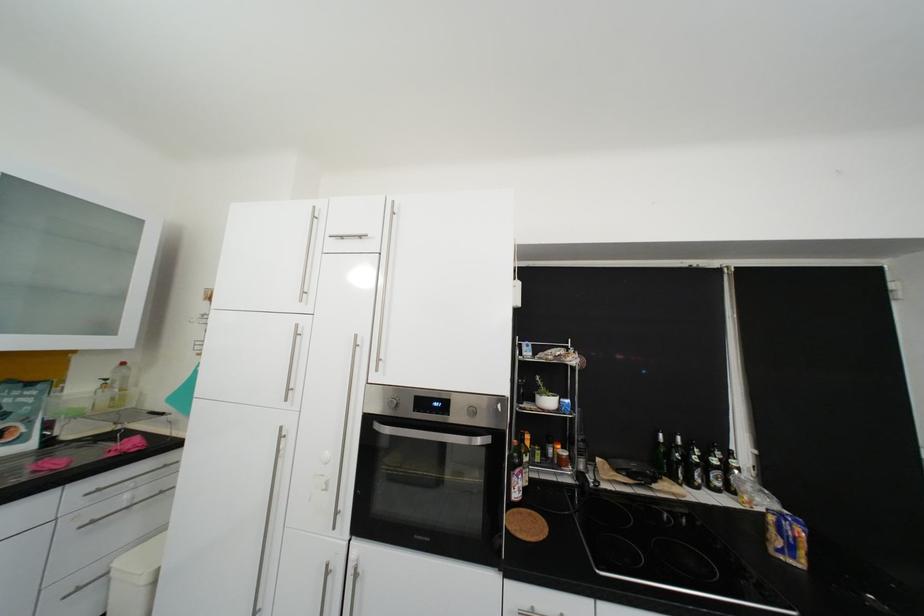
The width and height of the screenshot is (924, 616). What do you see at coordinates (431, 435) in the screenshot?
I see `the oven door handle` at bounding box center [431, 435].